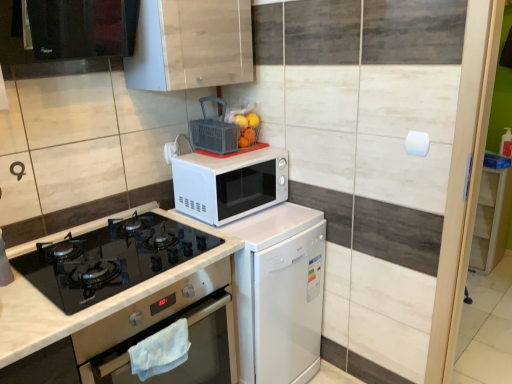
Question: Is point (197, 130) positioned closer to the camera than point (143, 56)?

Choices:
 (A) farther
 (B) closer

Answer: (A)

Question: From the image's perspective, relative to wooden cabinet at upper center, which is the second cabinetry from right to left, is matte plastic basket at upper center, which ranks as the second appliance in left-to-right order, above or below?

Choices:
 (A) above
 (B) below

Answer: (B)

Question: Based on their relative distances, which object is farther from the white matte microwave at center?

Choices:
 (A) white marble countertop at lower left
 (B) white matte microwave at center, which ranks as the 1th appliance in left-to-right order
 (C) white glossy dishwasher at center
 (D) matte plastic basket at upper center, the first appliance in the right-to-left sequence
 (E) black glass oven at lower left

Answer: (E)

Question: Estimate the real-world distances between objects in this image. Which object is farther from the black glass exhaust hood at upper left?

Choices:
 (A) white matte microwave at center
 (B) white glossy dishwasher at center
 (C) wooden cabinet at upper center, which is the second cabinetry from right to left
 (D) matte plastic basket at upper center, which ranks as the second appliance in left-to-right order
 (E) black glass oven at lower left

Answer: (B)